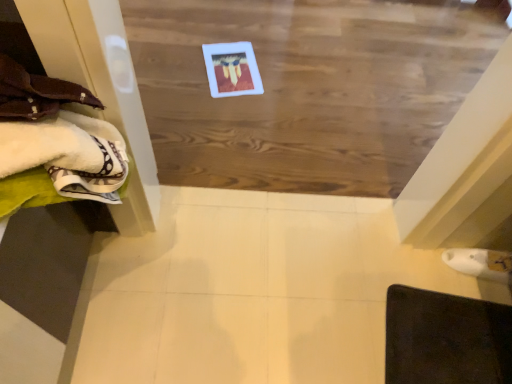
Question: From the image's perspective, is white soft towels at left above dark brown leather mat at lower right?

Choices:
 (A) no
 (B) yes

Answer: (B)

Question: Can you confirm if white soft towels at left is positioned to the right of dark brown leather mat at lower right?

Choices:
 (A) yes
 (B) no

Answer: (B)

Question: Does white soft towels at left have a lesser height compared to dark brown leather mat at lower right?

Choices:
 (A) no
 (B) yes

Answer: (A)

Question: Is dark brown leather mat at lower right at the back of white soft towels at left?

Choices:
 (A) yes
 (B) no

Answer: (B)

Question: Could you tell me if white soft towels at left is facing dark brown leather mat at lower right?

Choices:
 (A) no
 (B) yes

Answer: (A)

Question: Can you confirm if white soft towels at left is bigger than dark brown leather mat at lower right?

Choices:
 (A) yes
 (B) no

Answer: (A)

Question: Can you confirm if wooden board at center is thinner than white soft towels at left?

Choices:
 (A) yes
 (B) no

Answer: (B)

Question: Considering the relative sizes of wooden board at center and white soft towels at left in the image provided, is wooden board at center smaller than white soft towels at left?

Choices:
 (A) no
 (B) yes

Answer: (A)

Question: Is wooden board at center positioned before white soft towels at left?

Choices:
 (A) yes
 (B) no

Answer: (B)

Question: Is wooden board at center positioned with its back to white soft towels at left?

Choices:
 (A) yes
 (B) no

Answer: (B)

Question: Is wooden board at center placed right next to white soft towels at left?

Choices:
 (A) no
 (B) yes

Answer: (A)

Question: Considering the relative sizes of wooden board at center and white soft towels at left in the image provided, is wooden board at center bigger than white soft towels at left?

Choices:
 (A) no
 (B) yes

Answer: (B)

Question: From a real-world perspective, is dark brown leather mat at lower right on white soft towels at left?

Choices:
 (A) yes
 (B) no

Answer: (B)